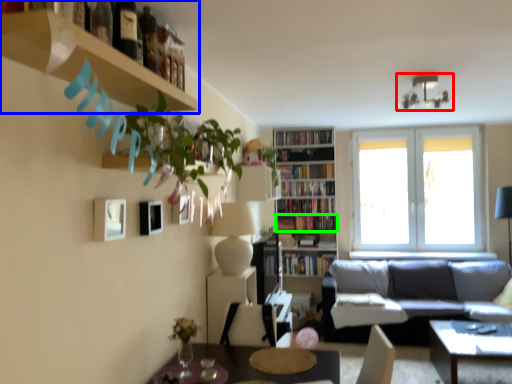
Question: Which object is the closest to the lamp (highlighted by a red box)? Choose among these: shelf (highlighted by a blue box) or book (highlighted by a green box).

Choices:
 (A) shelf
 (B) book

Answer: (B)